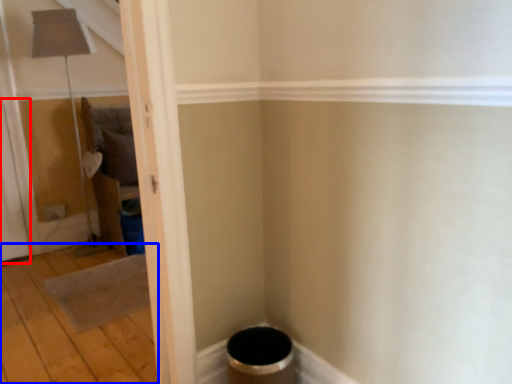
Question: Which object appears farthest to the camera in this image, screen door (highlighted by a red box) or plywood (highlighted by a blue box)?

Choices:
 (A) screen door
 (B) plywood

Answer: (A)